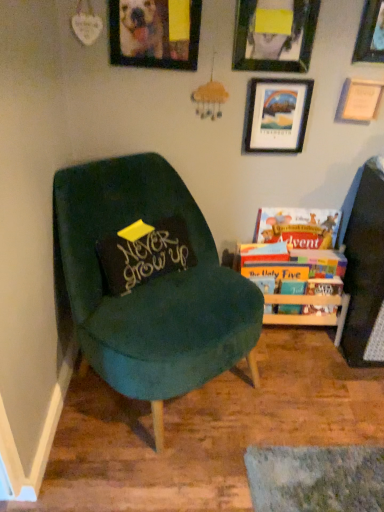
Question: Can you confirm if black velvet pillow at center is positioned to the left of wooden picture frame at upper center, which is the first picture frame in left-to-right order?

Choices:
 (A) yes
 (B) no

Answer: (A)

Question: From the image's perspective, is black velvet pillow at center beneath wooden picture frame at upper center, which is the first picture frame in left-to-right order?

Choices:
 (A) yes
 (B) no

Answer: (A)

Question: Can you confirm if black velvet pillow at center is smaller than wooden picture frame at upper center, placed as the 5th picture frame when sorted from right to left?

Choices:
 (A) no
 (B) yes

Answer: (A)

Question: Can wooden picture frame at upper center, which is the first picture frame in left-to-right order, be found inside black velvet pillow at center?

Choices:
 (A) yes
 (B) no

Answer: (B)

Question: Can you confirm if black velvet pillow at center is bigger than wooden picture frame at upper center, placed as the 5th picture frame when sorted from right to left?

Choices:
 (A) yes
 (B) no

Answer: (A)

Question: Does black velvet pillow at center lie behind wooden picture frame at upper center, placed as the 5th picture frame when sorted from right to left?

Choices:
 (A) yes
 (B) no

Answer: (A)

Question: Considering the relative sizes of velvet green chair at left and hardcover book at right, the 2th book from the bottom, in the image provided, is velvet green chair at left taller than hardcover book at right, the 2th book from the bottom,?

Choices:
 (A) yes
 (B) no

Answer: (A)

Question: Does velvet green chair at left come in front of hardcover book at right, which is the 1th book in top-to-bottom order?

Choices:
 (A) yes
 (B) no

Answer: (A)

Question: From the image's perspective, is velvet green chair at left below hardcover book at right, the 2th book from the bottom?

Choices:
 (A) yes
 (B) no

Answer: (A)

Question: Is velvet green chair at left next to hardcover book at right, the 2th book from the bottom?

Choices:
 (A) no
 (B) yes

Answer: (A)

Question: Considering the relative sizes of velvet green chair at left and hardcover book at right, which is the 1th book in top-to-bottom order, in the image provided, is velvet green chair at left shorter than hardcover book at right, which is the 1th book in top-to-bottom order,?

Choices:
 (A) yes
 (B) no

Answer: (B)

Question: Is velvet green chair at left oriented away from hardcover book at right, which is the 1th book in top-to-bottom order?

Choices:
 (A) no
 (B) yes

Answer: (A)

Question: Would you say hardcover books at right, which is the first book from bottom to top, contains velvet green chair at left?

Choices:
 (A) no
 (B) yes

Answer: (A)